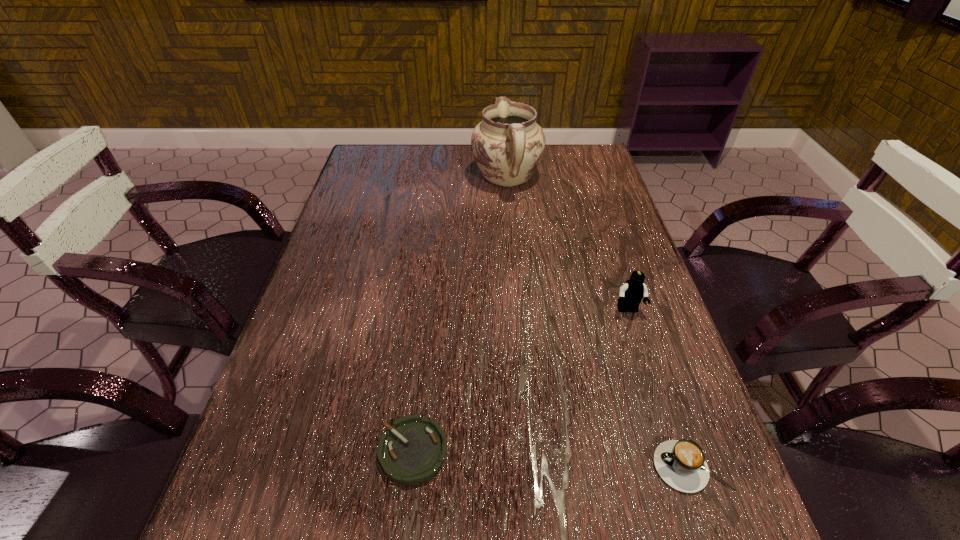
In order to click on vacant space situated 0.310m with the handle on the side of the second shortest object in this screenshot , I will do `click(463, 467)`.

At what (x,y) coordinates should I click in order to perform the action: click on free space located 0.390m with the handle on the side of the second shortest object. Please return your answer as a coordinate pair (x, y). Looking at the image, I should click on (414, 467).

At what (x,y) coordinates should I click in order to perform the action: click on vacant space located on the left of the ashtray. Please return your answer as a coordinate pair (x, y). This screenshot has width=960, height=540. Looking at the image, I should click on (325, 451).

Where is `object at the far edge`? object at the far edge is located at coordinates pos(508,145).

You are a GUI agent. You are given a task and a screenshot of the screen. Output one action in this format:
    pyautogui.click(x=<x>, y=<y>)
    Task: Click on the Lego that is at the right edge
    Image resolution: width=960 pixels, height=540 pixels.
    Given the screenshot: What is the action you would take?
    pyautogui.click(x=631, y=293)

At what (x,y) coordinates should I click in order to perform the action: click on cappuccino that is positioned at the right edge. Please return your answer as a coordinate pair (x, y). The image size is (960, 540). Looking at the image, I should click on (681, 464).

What are the coordinates of `vacant area at the left edge of the desktop` in the screenshot? It's located at (372, 202).

In the image, there is a desktop. Identify the location of vacant space at the right edge. Image resolution: width=960 pixels, height=540 pixels. pos(648,392).

What are the coordinates of `vacant space at the far right corner of the desktop` in the screenshot? It's located at click(x=594, y=145).

Locate an element on the screen. This screenshot has width=960, height=540. unoccupied position between the cappuccino and the third shortest object is located at coordinates (660, 389).